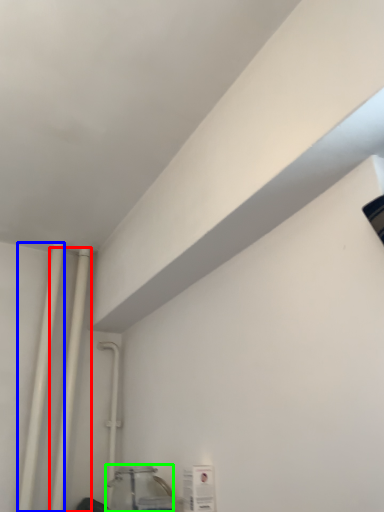
Question: Which object is the closest to the pipe (highlighted by a red box)? Choose among these: pipe (highlighted by a blue box) or glass jar (highlighted by a green box).

Choices:
 (A) pipe
 (B) glass jar

Answer: (A)